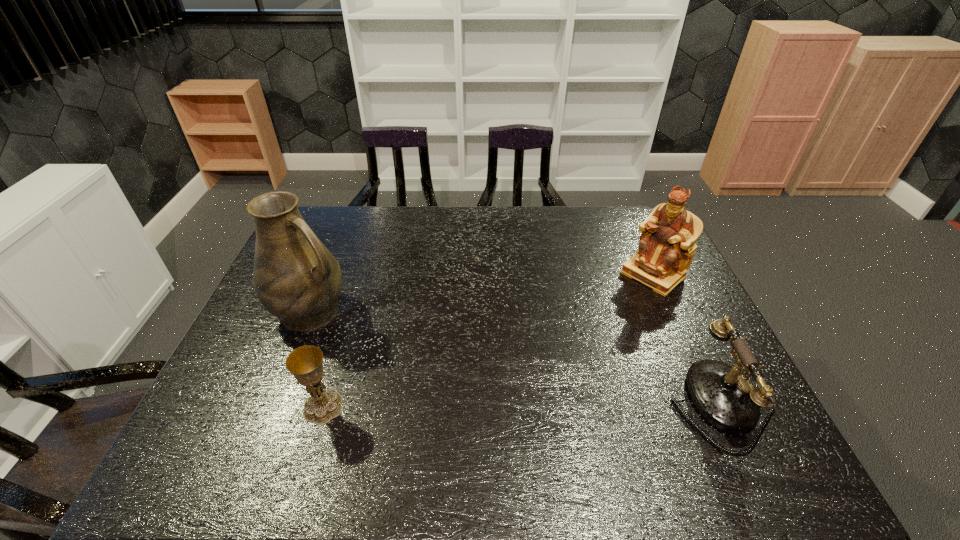
Find the location of a particular element. chalice is located at coordinates (305, 363).

Where is `telephone`? This screenshot has height=540, width=960. telephone is located at coordinates (726, 399).

In order to click on figurine in this screenshot , I will do `click(666, 248)`.

Where is `the tallest object`? Image resolution: width=960 pixels, height=540 pixels. the tallest object is located at coordinates (296, 278).

The image size is (960, 540). What are the coordinates of `blank area located 0.080m on the back of the chalice` in the screenshot? It's located at (337, 363).

Locate an element on the screen. Image resolution: width=960 pixels, height=540 pixels. vacant space located 0.220m on the front-facing side of the figurine is located at coordinates (590, 326).

The width and height of the screenshot is (960, 540). Identify the location of vacant space located on the front-facing side of the figurine. (582, 334).

The height and width of the screenshot is (540, 960). Identify the location of vacant position located 0.140m on the front-facing side of the figurine. (608, 312).

Find the location of a particular element. This screenshot has width=960, height=540. free spot located on the handle side of the tallest object is located at coordinates (376, 347).

The image size is (960, 540). In order to click on free space located on the handle side of the tallest object in this screenshot , I will do `click(418, 370)`.